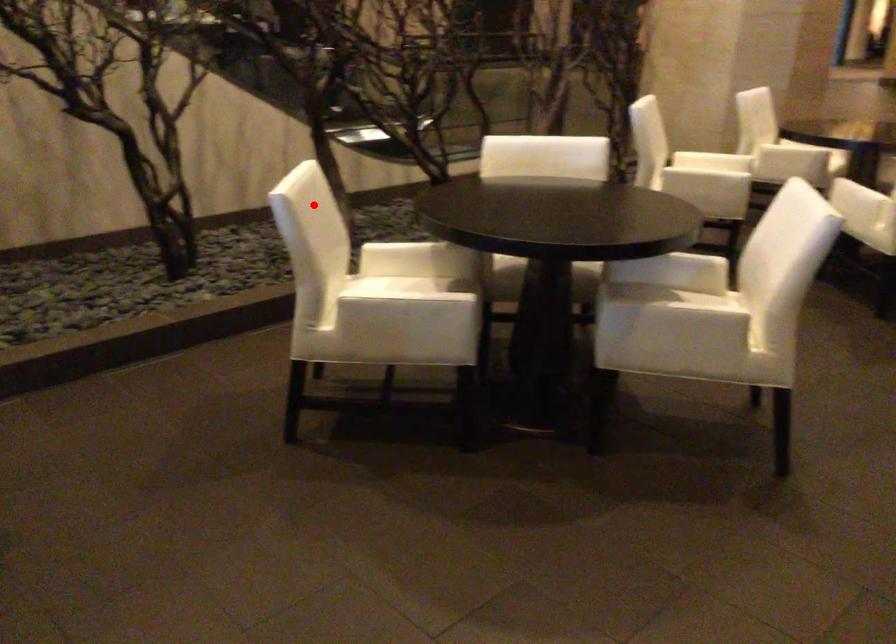
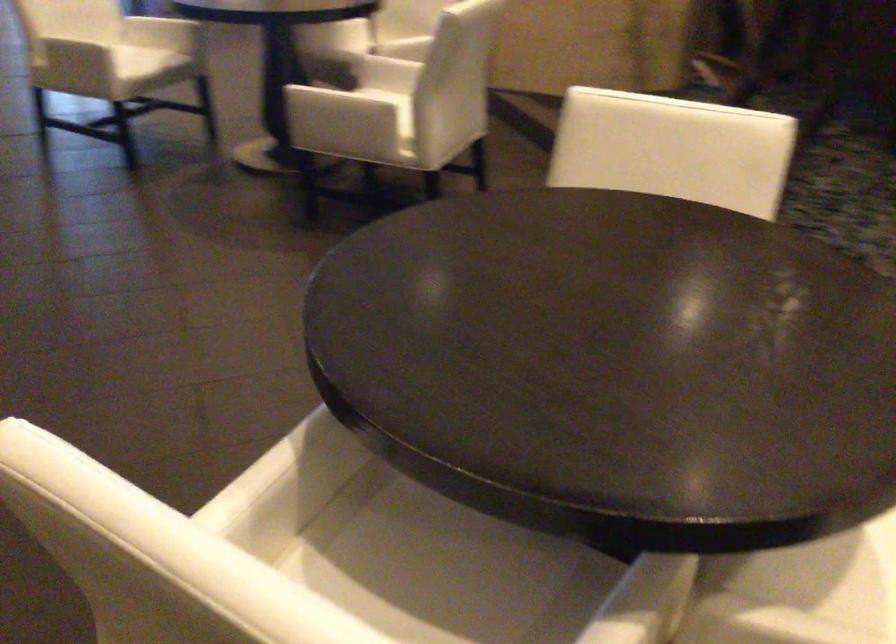
Question: I am providing you with two images of the same scene from different viewpoints. Given a red point in image1, look at the same physical point in image2. Is it:

Choices:
 (A) Closer to the viewpoint
 (B) Farther from the viewpoint

Answer: (A)